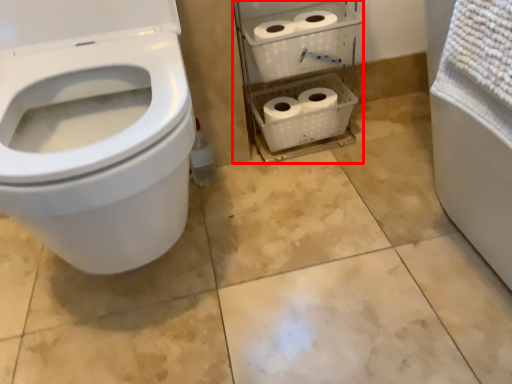
Question: From the image's perspective, considering the relative positions of shelf (annotated by the red box) and toilet in the image provided, where is shelf (annotated by the red box) located with respect to the staircase?

Choices:
 (A) below
 (B) above

Answer: (B)